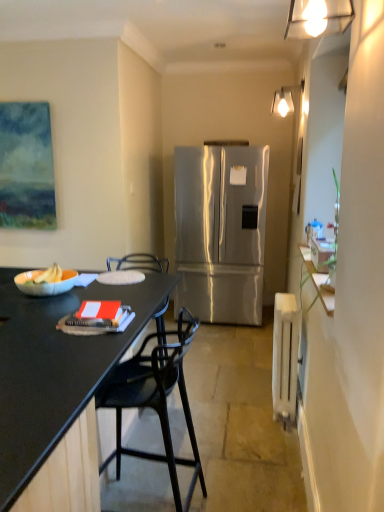
Question: Does orange matte book at left turn towards stainless steel refrigerator at center?

Choices:
 (A) yes
 (B) no

Answer: (B)

Question: Can you confirm if orange matte book at left is positioned to the right of stainless steel refrigerator at center?

Choices:
 (A) no
 (B) yes

Answer: (A)

Question: Is orange matte book at left completely or partially outside of stainless steel refrigerator at center?

Choices:
 (A) yes
 (B) no

Answer: (A)

Question: Is orange matte book at left next to stainless steel refrigerator at center?

Choices:
 (A) yes
 (B) no

Answer: (B)

Question: Is orange matte book at left wider than stainless steel refrigerator at center?

Choices:
 (A) yes
 (B) no

Answer: (B)

Question: Is the depth of orange matte book at left greater than that of stainless steel refrigerator at center?

Choices:
 (A) no
 (B) yes

Answer: (A)

Question: Is black matte desk at left not close to matte white bowl at left?

Choices:
 (A) yes
 (B) no

Answer: (B)

Question: From a real-world perspective, is black matte desk at left physically above matte white bowl at left?

Choices:
 (A) no
 (B) yes

Answer: (A)

Question: Would you say black matte desk at left is outside matte white bowl at left?

Choices:
 (A) no
 (B) yes

Answer: (B)

Question: Is black matte desk at left behind matte white bowl at left?

Choices:
 (A) no
 (B) yes

Answer: (A)

Question: Does black matte desk at left have a lesser width compared to matte white bowl at left?

Choices:
 (A) no
 (B) yes

Answer: (A)

Question: Can you confirm if black matte desk at left is bigger than matte white bowl at left?

Choices:
 (A) yes
 (B) no

Answer: (A)

Question: Considering the relative sizes of matte white bowl at left and white plastic radiator at right in the image provided, is matte white bowl at left wider than white plastic radiator at right?

Choices:
 (A) no
 (B) yes

Answer: (B)